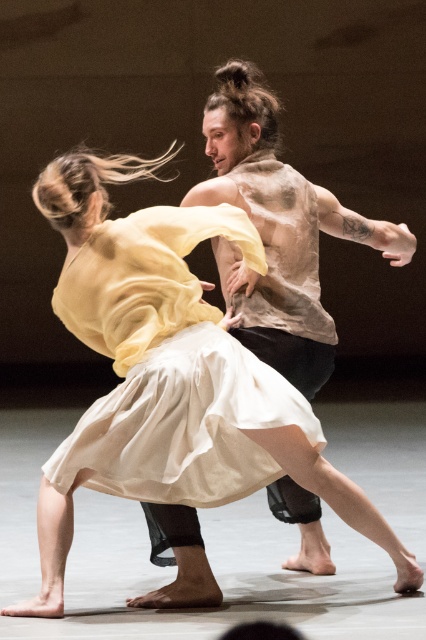
Question: Can you confirm if matte yellow fabric at center is positioned below translucent beige shirt at center?

Choices:
 (A) yes
 (B) no

Answer: (A)

Question: Which point is farther to the camera?

Choices:
 (A) translucent beige shirt at center
 (B) matte yellow fabric at center

Answer: (A)

Question: Can you confirm if matte yellow fabric at center is smaller than translucent beige shirt at center?

Choices:
 (A) yes
 (B) no

Answer: (B)

Question: Among these objects, which one is nearest to the camera?

Choices:
 (A) translucent beige shirt at center
 (B) matte yellow fabric at center

Answer: (B)

Question: Does matte yellow fabric at center appear under translucent beige shirt at center?

Choices:
 (A) yes
 (B) no

Answer: (A)